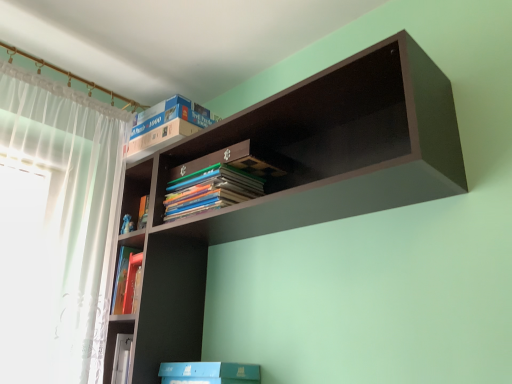
Question: Is point (395, 198) positioned closer to the camera than point (164, 130)?

Choices:
 (A) closer
 (B) farther

Answer: (A)

Question: In terms of width, does dark wood shelf at upper center look wider or thinner when compared to blue cardboard box at upper center?

Choices:
 (A) thin
 (B) wide

Answer: (B)

Question: In terms of height, does dark wood shelf at upper center look taller or shorter compared to blue cardboard box at upper center?

Choices:
 (A) short
 (B) tall

Answer: (B)

Question: Considering the positions of blue cardboard box at upper center and dark wood shelf at upper center in the image, is blue cardboard box at upper center wider or thinner than dark wood shelf at upper center?

Choices:
 (A) wide
 (B) thin

Answer: (B)

Question: From a real-world perspective, is blue cardboard box at upper center positioned above or below dark wood shelf at upper center?

Choices:
 (A) above
 (B) below

Answer: (A)

Question: In terms of height, does blue cardboard box at upper center look taller or shorter compared to dark wood shelf at upper center?

Choices:
 (A) tall
 (B) short

Answer: (B)

Question: In terms of size, does blue cardboard box at upper center appear bigger or smaller than dark wood shelf at upper center?

Choices:
 (A) small
 (B) big

Answer: (A)